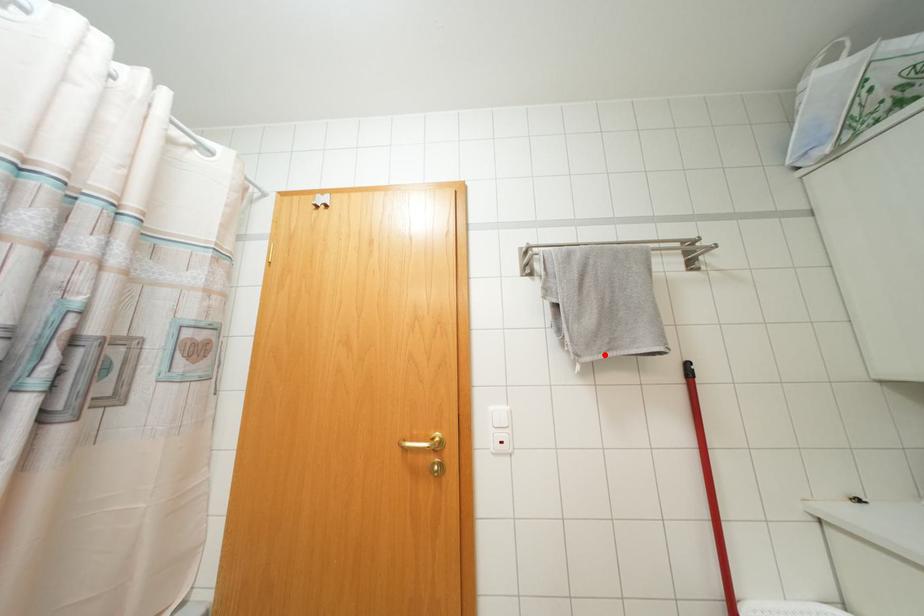
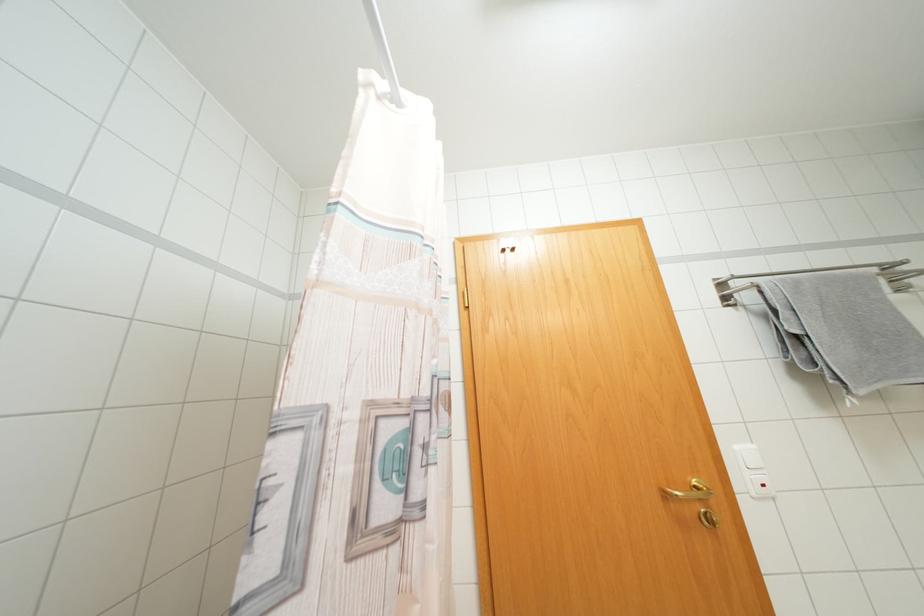
Question: I am providing you with two images of the same scene from different viewpoints. Given a red point in image1, look at the same physical point in image2. Is it:

Choices:
 (A) Closer to the viewpoint
 (B) Farther from the viewpoint

Answer: (A)